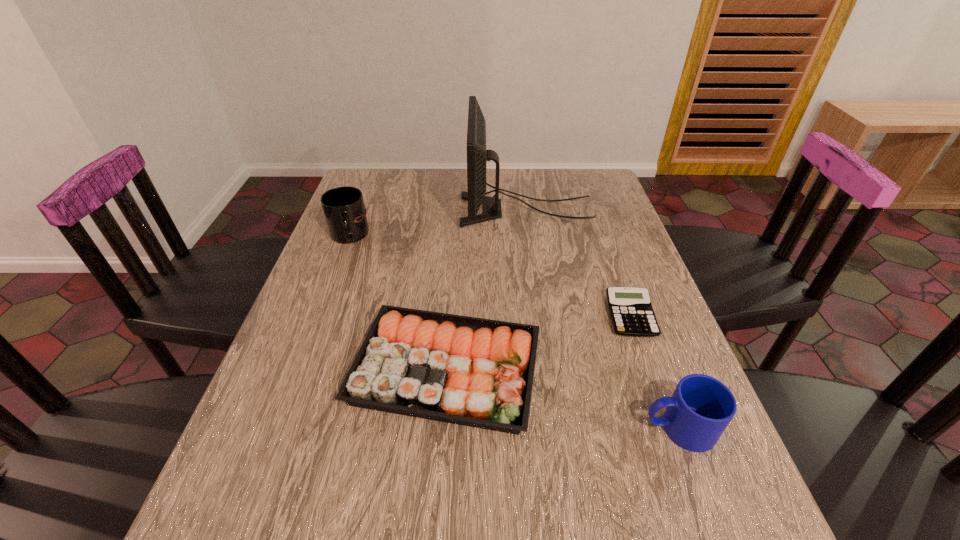
Identify the location of the tallest object. (477, 156).

Find the location of a particular element. The image size is (960, 540). the second tallest object is located at coordinates (344, 210).

You are a GUI agent. You are given a task and a screenshot of the screen. Output one action in this format:
    pyautogui.click(x=<x>, y=<y>)
    Task: Click on the farther mug
    The height and width of the screenshot is (540, 960).
    Given the screenshot: What is the action you would take?
    pyautogui.click(x=344, y=210)

Locate an element on the screen. the nearer mug is located at coordinates (701, 407).

You are a GUI agent. You are given a task and a screenshot of the screen. Output one action in this format:
    pyautogui.click(x=<x>, y=<y>)
    Task: Click on the shorter mug
    This screenshot has height=540, width=960.
    Given the screenshot: What is the action you would take?
    pyautogui.click(x=701, y=407)

At what (x,y) coordinates should I click in order to perform the action: click on the fourth tallest object. Please return your answer as a coordinate pair (x, y). This screenshot has height=540, width=960. Looking at the image, I should click on [x=475, y=372].

Where is `calculator`? This screenshot has width=960, height=540. calculator is located at coordinates (630, 308).

The image size is (960, 540). Find the location of `free location located 0.180m on the screen side of the computer monitor`. free location located 0.180m on the screen side of the computer monitor is located at coordinates (402, 210).

Where is `vacant region located on the screen side of the computer monitor`? The image size is (960, 540). vacant region located on the screen side of the computer monitor is located at coordinates (428, 210).

Locate an element on the screen. Image resolution: width=960 pixels, height=540 pixels. vacant space positioned on the screen side of the computer monitor is located at coordinates (442, 210).